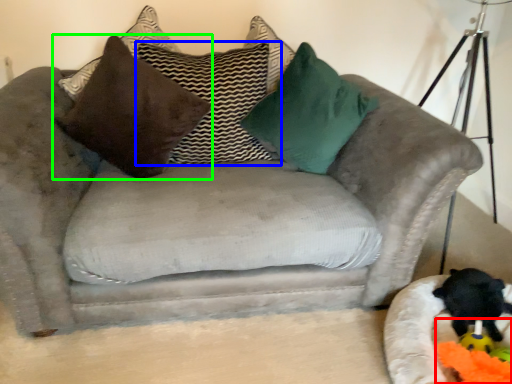
Question: Which object is the farthest from toy (highlighted by a red box)? Choose among these: pillow (highlighted by a blue box) or pillow (highlighted by a green box).

Choices:
 (A) pillow
 (B) pillow

Answer: (B)